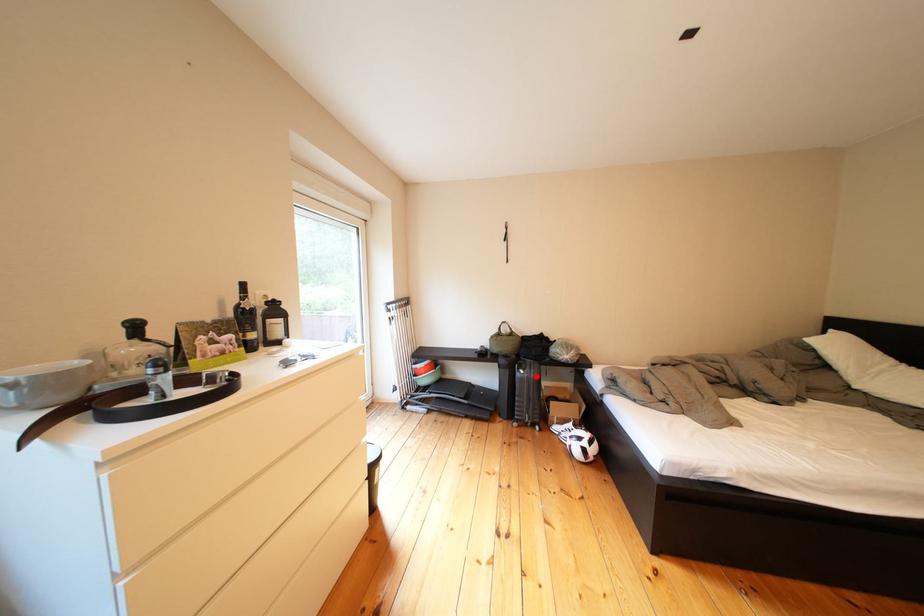
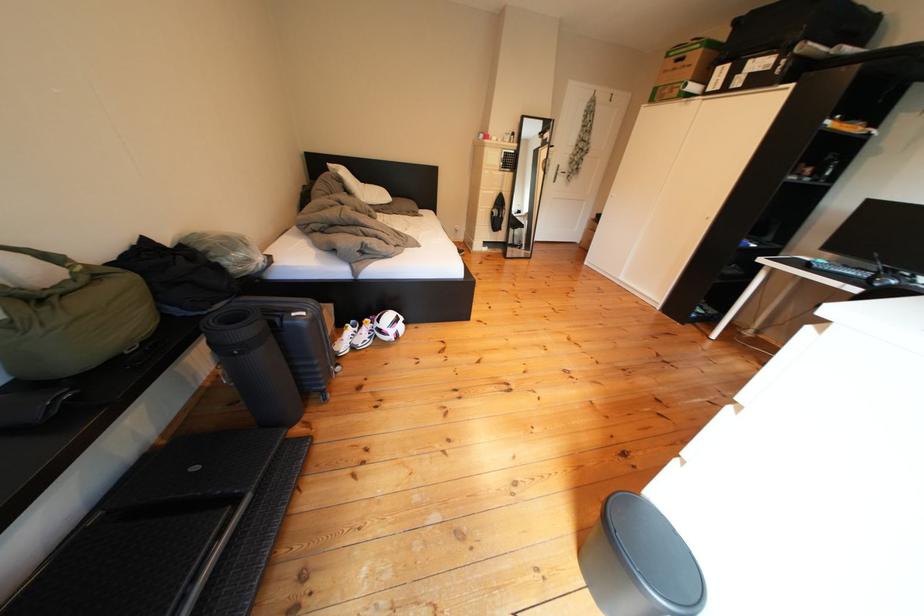
Find the pixel in the second image that matches the highlighted location in the first image.

(317, 318)